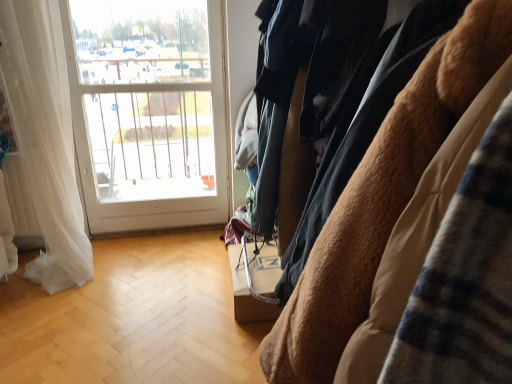
The width and height of the screenshot is (512, 384). What are the coordinates of `vacant area that lies in front of white sheer curtain at left` in the screenshot? It's located at (38, 299).